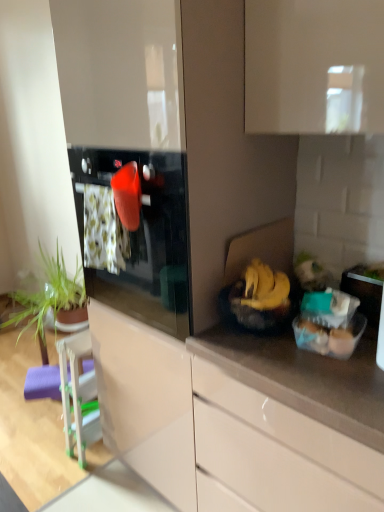
The image size is (384, 512). I want to click on free space in front of white glossy chair at lower left, positioned as the second appliance in right-to-left order, so click(x=84, y=482).